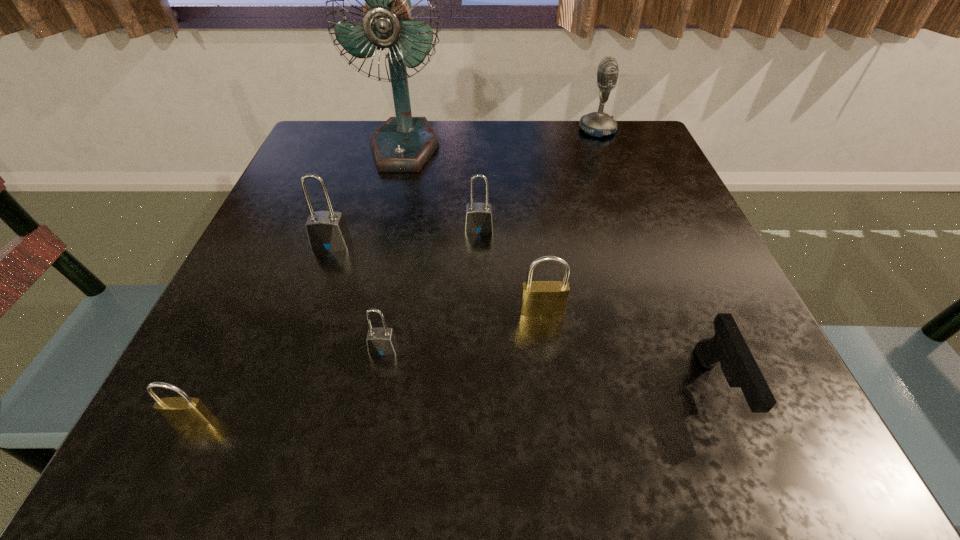
I want to click on object at the far left corner, so click(x=403, y=143).

The image size is (960, 540). What are the coordinates of `object situated at the near left corner` in the screenshot? It's located at (183, 411).

Identify the location of object that is at the far right corner. The height and width of the screenshot is (540, 960). (597, 124).

The height and width of the screenshot is (540, 960). Identify the location of object that is positioned at the near right corner. (727, 347).

The image size is (960, 540). I want to click on vacant space at the far edge, so click(448, 156).

In the image, there is a desktop. Where is `blank space at the near edge`? blank space at the near edge is located at coordinates (300, 432).

Where is `vacant space at the left edge of the desktop`? This screenshot has height=540, width=960. vacant space at the left edge of the desktop is located at coordinates (289, 299).

In order to click on vacant space at the right edge of the desktop in this screenshot , I will do `click(653, 177)`.

What are the coordinates of `vacant space at the far left corner of the desktop` in the screenshot? It's located at (351, 157).

This screenshot has width=960, height=540. In the image, there is a desktop. Find the location of `vacant space at the far right corner`. vacant space at the far right corner is located at coordinates (599, 137).